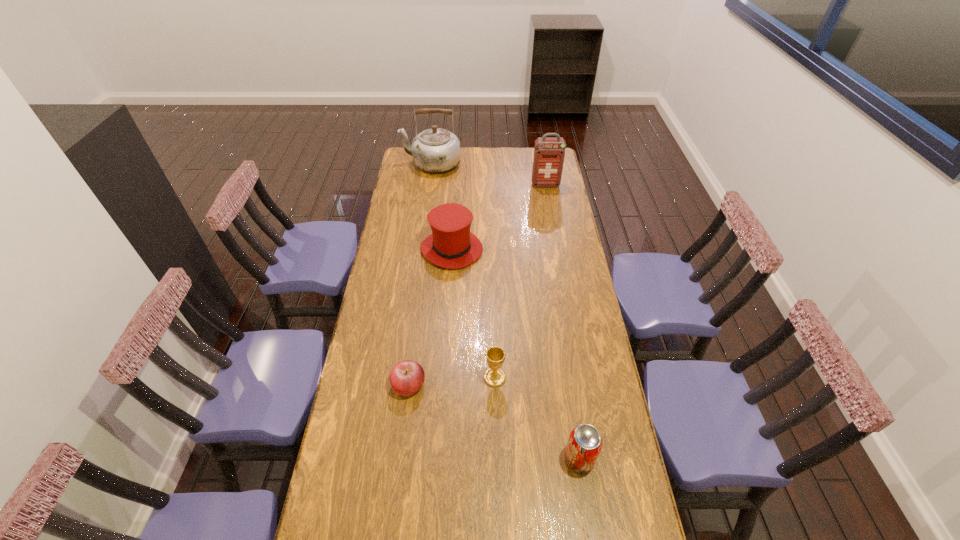
In the image, there is a desktop. What are the coordinates of `free space at the right edge` in the screenshot? It's located at (618, 531).

Find the location of a particular element. vacant space that is in between the fourth shortest object and the shortest object is located at coordinates (430, 317).

The height and width of the screenshot is (540, 960). What are the coordinates of `free spot between the chalice and the apple` in the screenshot? It's located at (452, 381).

This screenshot has height=540, width=960. Identify the location of free point between the shortest object and the chalice. (452, 381).

Locate an element on the screen. Image resolution: width=960 pixels, height=540 pixels. vacant area that lies between the third tallest object and the chalice is located at coordinates (473, 313).

At what (x,y) coordinates should I click in order to perform the action: click on vacant space that is in between the hat and the shortest object. Please return your answer as a coordinate pair (x, y). The image size is (960, 540). Looking at the image, I should click on (430, 317).

At what (x,y) coordinates should I click in order to perform the action: click on free area in between the apple and the farthest object. Please return your answer as a coordinate pair (x, y). The height and width of the screenshot is (540, 960). Looking at the image, I should click on (420, 274).

The image size is (960, 540). Identify the location of vacant space that is in between the chalice and the apple. (452, 381).

Select which object is the closest to the chalice. Please provide its 2D coordinates. Your answer should be formatted as a tuple, i.e. [(x, y)], where the tuple contains the x and y coordinates of a point satisfying the conditions above.

[(407, 377)]

The width and height of the screenshot is (960, 540). In order to click on object that is the closest to the chalice in this screenshot , I will do `click(407, 377)`.